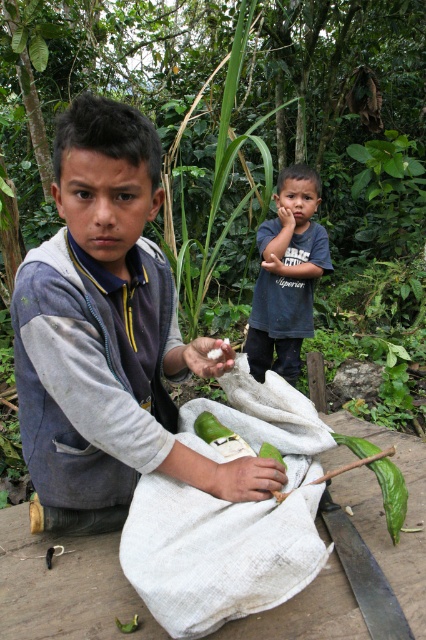
You are a tailor measuring fabrics for a project. You have a gray fleece jacket at left and a white woven cloth at center. Which item is wider?

The gray fleece jacket at left is wider than the white woven cloth at center according to the description provided.

Based on the scene description, where is the white woven cloth at center located in the image?

The white woven cloth at center is located at the point coordinates of (230, 516) in the image.

You are a photographer trying to capture a closeup shot of the point at location point (20, 291) and point (181, 497). Which point should you focus on to get a clearer image?

Point (20, 291) is closer to the viewer than point (181, 497), so focusing on point (20, 291) will result in a clearer image.